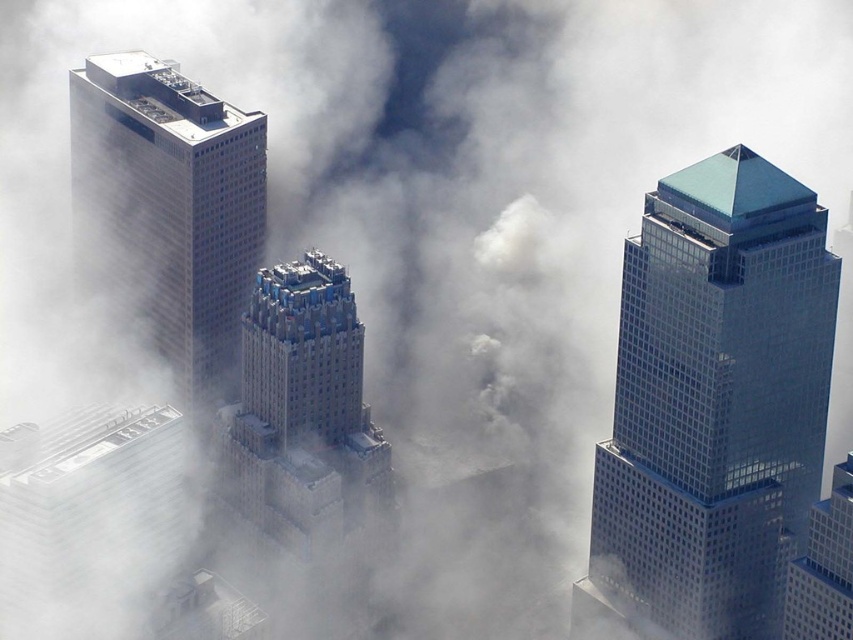
Which of these two, matte glass skyscraper at left or white fluffy cloud at center, stands taller?

matte glass skyscraper at left is taller.

Is matte glass skyscraper at left bigger than white fluffy cloud at center?

Indeed, matte glass skyscraper at left has a larger size compared to white fluffy cloud at center.

Identify the location of matte glass skyscraper at left. (173, 204).

Where is `matte glass skyscraper at left`? matte glass skyscraper at left is located at coordinates (173, 204).

Which is more to the left, matte glass skyscraper at left or gray concrete skyscraper at center?

matte glass skyscraper at left

Can you confirm if matte glass skyscraper at left is bigger than gray concrete skyscraper at center?

Yes.

Is point (218, 147) positioned behind point (277, 392)?

Yes, it is behind point (277, 392).

You are a GUI agent. You are given a task and a screenshot of the screen. Output one action in this format:
    pyautogui.click(x=<x>, y=<y>)
    Task: Click on the matte glass skyscraper at left
    Image resolution: width=853 pixels, height=640 pixels.
    Given the screenshot: What is the action you would take?
    pyautogui.click(x=173, y=204)

Which is above, glassy blue skyscraper at center or gray concrete skyscraper at center?

glassy blue skyscraper at center

Which of these two, glassy blue skyscraper at center or gray concrete skyscraper at center, stands shorter?

gray concrete skyscraper at center

Is point (688, 308) positioned in front of point (343, 406)?

No.

Locate an element on the screen. The width and height of the screenshot is (853, 640). glassy blue skyscraper at center is located at coordinates (715, 401).